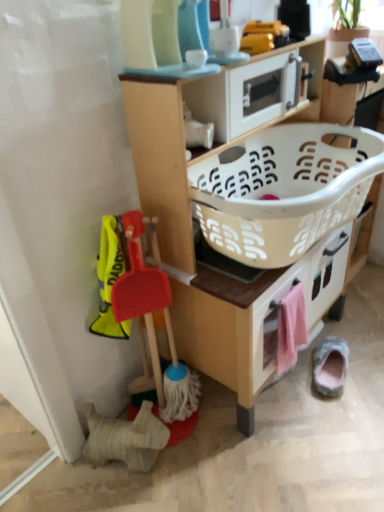
Describe the element at coordinates (330, 366) in the screenshot. I see `gray suede slipper at lower right` at that location.

This screenshot has width=384, height=512. Find the location of `white plastic microwave at upper center`. white plastic microwave at upper center is located at coordinates tap(262, 91).

The image size is (384, 512). I want to click on pink fabric drawer at lower right, so click(x=274, y=325).

What do you see at coordinates (283, 190) in the screenshot? The width and height of the screenshot is (384, 512). I see `white plastic basket at center` at bounding box center [283, 190].

I want to click on white plastic basket at center, so click(x=283, y=190).

The image size is (384, 512). I want to click on gray suede slipper at lower right, so click(x=330, y=366).

Which is in front, point (263, 353) or point (257, 170)?

The point (263, 353) is closer.

Which object is further away from the camera taking this photo, pink fabric drawer at lower right or white plastic basket at center?

Positioned behind is pink fabric drawer at lower right.

Is pink fabric drawer at lower right at the right side of white plastic basket at center?

Correct, you'll find pink fabric drawer at lower right to the right of white plastic basket at center.

From a real-world perspective, between pink fabric drawer at lower right and white plastic basket at center, who is vertically lower?

pink fabric drawer at lower right is physically lower.

At what (x,y) coordinates should I click in order to perform the action: click on shelf on the left of gray suede slipper at lower right. Please return your answer as a coordinate pair (x, y). Looking at the image, I should click on (244, 220).

Is gray suede slipper at lower right facing towards wooden toy kitchen at center?

No, gray suede slipper at lower right does not turn towards wooden toy kitchen at center.

Does point (340, 392) appear closer or farther from the camera than point (233, 348)?

Point (340, 392) is positioned farther from the camera compared to point (233, 348).

In terms of height, does gray suede slipper at lower right look taller or shorter compared to wooden toy kitchen at center?

Clearly, gray suede slipper at lower right is shorter compared to wooden toy kitchen at center.

Can you tell me how much wooden toy kitchen at center and pink fabric drawer at lower right differ in facing direction?

They differ by 4.64e-05 degrees in their facing directions.

From a real-world perspective, is wooden toy kitchen at center above or below pink fabric drawer at lower right?

From a real-world perspective, wooden toy kitchen at center is physically above pink fabric drawer at lower right.

Is wooden toy kitchen at center at the right side of pink fabric drawer at lower right?

In fact, wooden toy kitchen at center is to the left of pink fabric drawer at lower right.

Which point is more distant from viewer, (158,169) or (289,287)?

Positioned behind is point (289,287).

From the image's perspective, would you say wooden toy kitchen at center is positioned over gray suede slipper at lower right?

Yes, from the image's perspective, wooden toy kitchen at center is on top of gray suede slipper at lower right.

How different are the orientations of wooden toy kitchen at center and gray suede slipper at lower right in degrees?

The angle between the facing direction of wooden toy kitchen at center and the facing direction of gray suede slipper at lower right is 18.4 degrees.

In terms of width, does wooden toy kitchen at center look wider or thinner when compared to gray suede slipper at lower right?

Clearly, wooden toy kitchen at center has more width compared to gray suede slipper at lower right.

Is white plastic microwave at upper center aimed at gray suede slipper at lower right?

No, white plastic microwave at upper center is not turned towards gray suede slipper at lower right.

Considering the positions of point (257, 65) and point (335, 396), is point (257, 65) closer or farther from the camera than point (335, 396)?

Clearly, point (257, 65) is closer to the camera than point (335, 396).

From the image's perspective, which one is positioned lower, white plastic microwave at upper center or gray suede slipper at lower right?

gray suede slipper at lower right.

In order to click on footwear lying behind the white plastic microwave at upper center in this screenshot , I will do `click(330, 366)`.

From a real-world perspective, which is physically above, white plastic basket at center or wooden toy kitchen at center?

From a 3D spatial view, white plastic basket at center is above.

Image resolution: width=384 pixels, height=512 pixels. What are the coordinates of `basket that is above the wooden toy kitchen at center (from a real-world perspective)` in the screenshot? It's located at (283, 190).

Between white plastic basket at center and wooden toy kitchen at center, which one is positioned in front?

wooden toy kitchen at center is more forward.

Is white plastic basket at center positioned with its back to wooden toy kitchen at center?

Yes, wooden toy kitchen at center is at the back of white plastic basket at center.

From the image's perspective, does wooden toy kitchen at center appear higher than white plastic microwave at upper center?

Incorrect, from the image's perspective, wooden toy kitchen at center is lower than white plastic microwave at upper center.

How much distance is there between wooden toy kitchen at center and white plastic microwave at upper center?

A distance of 10.86 inches exists between wooden toy kitchen at center and white plastic microwave at upper center.

You are a GUI agent. You are given a task and a screenshot of the screen. Output one action in this format:
    pyautogui.click(x=<x>, y=<y>)
    Task: Click on the shelf lying on the right of white plastic microwave at upper center
    
    Given the screenshot: What is the action you would take?
    pyautogui.click(x=244, y=220)

You are a GUI agent. You are given a task and a screenshot of the screen. Output one action in this format:
    pyautogui.click(x=<x>, y=<y>)
    Task: Click on the basket above the pink fabric drawer at lower right (from the image's perspective)
    The image size is (384, 512).
    Given the screenshot: What is the action you would take?
    pyautogui.click(x=283, y=190)

Image resolution: width=384 pixels, height=512 pixels. Find the location of `footwear behind the wooden toy kitchen at center`. footwear behind the wooden toy kitchen at center is located at coordinates (330, 366).

When comparing their distances from white plastic microwave at upper center, does pink fabric drawer at lower right or wooden toy kitchen at center seem closer?

wooden toy kitchen at center lies closer to white plastic microwave at upper center than the other object.

Considering their positions, is white plastic microwave at upper center positioned further to gray suede slipper at lower right than wooden toy kitchen at center?

white plastic microwave at upper center.

When comparing their distances from pink fabric drawer at lower right, does white plastic basket at center or wooden toy kitchen at center seem closer?

wooden toy kitchen at center lies closer to pink fabric drawer at lower right than the other object.

Considering their positions, is white plastic microwave at upper center positioned further to wooden toy kitchen at center than white plastic basket at center?

white plastic microwave at upper center is positioned further to the anchor wooden toy kitchen at center.

From the image, which object appears to be farther from white plastic basket at center, pink fabric drawer at lower right or white plastic microwave at upper center?

pink fabric drawer at lower right lies further to white plastic basket at center than the other object.

From the image, which object appears to be farther from wooden toy kitchen at center, gray suede slipper at lower right or pink fabric drawer at lower right?

gray suede slipper at lower right is positioned further to the anchor wooden toy kitchen at center.

Based on their spatial positions, is white plastic basket at center or pink fabric drawer at lower right further from gray suede slipper at lower right?

white plastic basket at center.

Looking at the image, which one is located further to pink fabric drawer at lower right, white plastic microwave at upper center or white plastic basket at center?

Based on the image, white plastic microwave at upper center appears to be further to pink fabric drawer at lower right.

Locate an element on the screen. The width and height of the screenshot is (384, 512). basket that lies between white plastic microwave at upper center and pink fabric drawer at lower right from top to bottom is located at coordinates (283, 190).

The height and width of the screenshot is (512, 384). Find the location of `shelf between white plastic basket at center and pink fabric drawer at lower right in the vertical direction`. shelf between white plastic basket at center and pink fabric drawer at lower right in the vertical direction is located at coordinates (244, 220).

Find the location of a particular element. shelf that lies between white plastic microwave at upper center and pink fabric drawer at lower right from top to bottom is located at coordinates (244, 220).

Where is `drawer positioned between wooden toy kitchen at center and gray suede slipper at lower right from near to far`? This screenshot has width=384, height=512. drawer positioned between wooden toy kitchen at center and gray suede slipper at lower right from near to far is located at coordinates tap(274, 325).